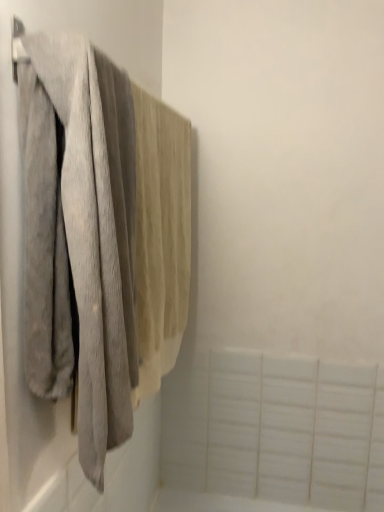
Identify the location of soft gray towel at left. (101, 236).

This screenshot has width=384, height=512. What do you see at coordinates (101, 236) in the screenshot?
I see `soft gray towel at left` at bounding box center [101, 236].

Image resolution: width=384 pixels, height=512 pixels. Find the location of `soft gray towel at left`. soft gray towel at left is located at coordinates (101, 236).